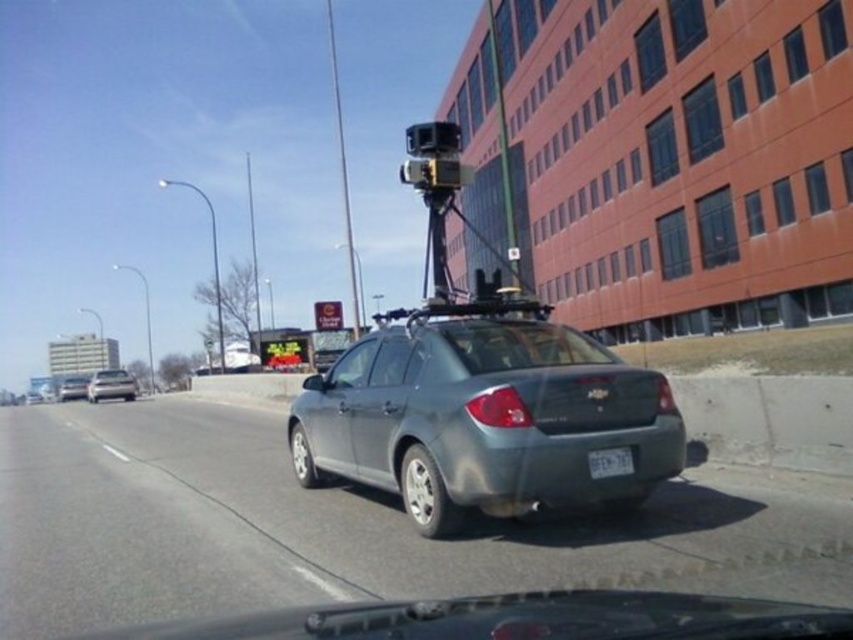
Which is below, satin silver sedan at left or white plastic license plate at center?

Positioned lower is satin silver sedan at left.

Is point (106, 388) closer to viewer compared to point (630, 460)?

No, (106, 388) is further to viewer.

Find the location of `satin silver sedan at left`. satin silver sedan at left is located at coordinates (111, 385).

Who is positioned more to the left, satin gray sedan at center or satin silver sedan at center?

satin silver sedan at center is more to the left.

Between point (392, 358) and point (68, 388), which one is positioned in front?

Positioned in front is point (392, 358).

Who is more distant from viewer, (x=379, y=355) or (x=86, y=392)?

Point (x=86, y=392)

The image size is (853, 640). I want to click on satin gray sedan at center, so click(x=483, y=416).

This screenshot has width=853, height=640. Describe the element at coordinates (483, 416) in the screenshot. I see `satin gray sedan at center` at that location.

Between point (656, 449) and point (129, 381), which one is positioned behind?

Positioned behind is point (129, 381).

Locate an element on the screen. The height and width of the screenshot is (640, 853). satin gray sedan at center is located at coordinates (483, 416).